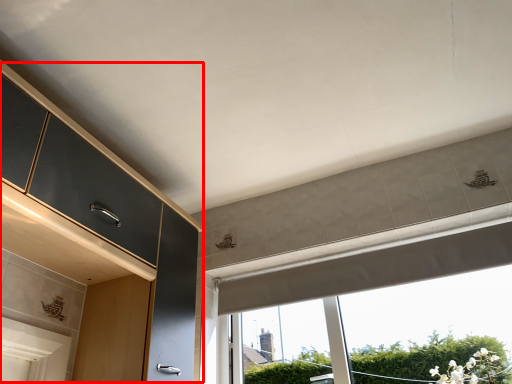
Question: From the image's perspective, where is dresser (annotated by the red box) located in relation to window in the image?

Choices:
 (A) below
 (B) above

Answer: (B)